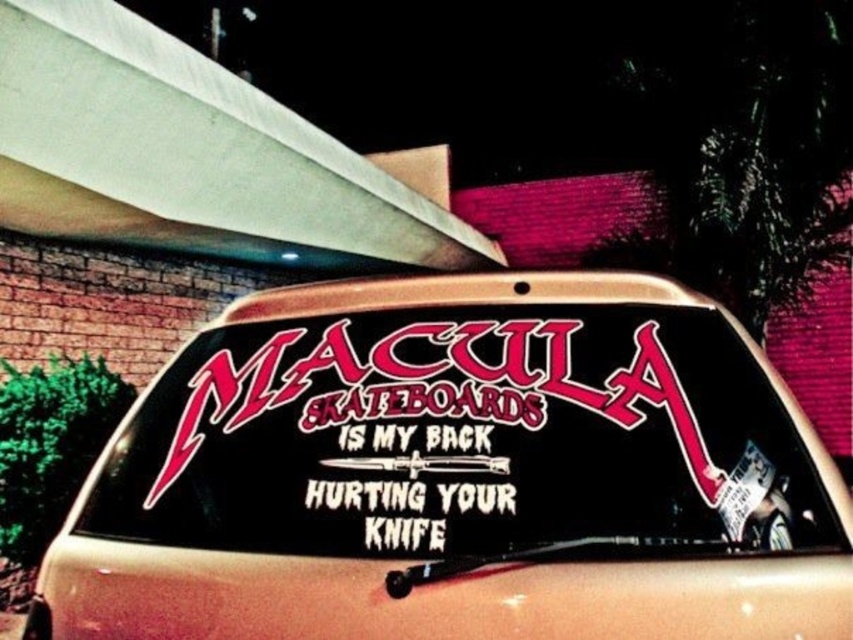
You are a photographer taking a picture of the rear window of a vehicle. You notice two points on the decal, one at point (461, 604) and another at point (763, 525). Which point will appear larger in your photo?

Point (461, 604) is closer to the viewer than point (763, 525), so it will appear larger in the photo.

You are a graphic designer who wants to place a new sticker on the vehicle window. You have two options from the scene, the black matte sticker at center and the white paper sticker at lower right. Which sticker should you choose if you want the one that is bigger?

The black matte sticker at center has a larger size compared to the white paper sticker at lower right, so choose the black matte sticker at center.